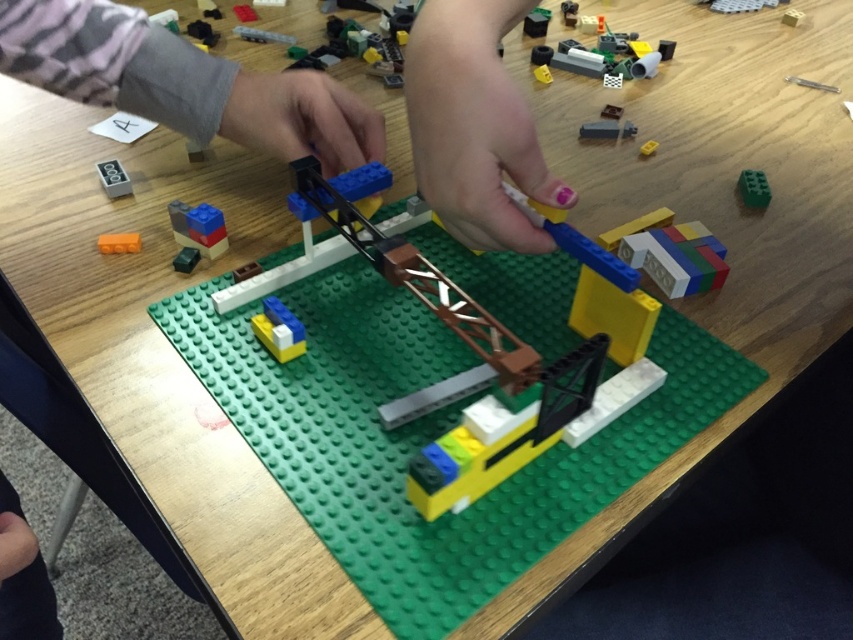
Question: Which point appears closest to the camera in this image?

Choices:
 (A) (793, 24)
 (B) (102, 236)
 (C) (517, 132)

Answer: (C)

Question: Is gray fabric sleeve at upper left to the right of yellow matte brick at center from the viewer's perspective?

Choices:
 (A) no
 (B) yes

Answer: (A)

Question: Which object appears farthest from the camera in this image?

Choices:
 (A) orange matte block at lower left
 (B) yellow matte plastic boat at center

Answer: (B)

Question: Considering the relative positions of matte black sign at upper left and orange matte block at lower left in the image provided, where is matte black sign at upper left located with respect to orange matte block at lower left?

Choices:
 (A) right
 (B) left

Answer: (B)

Question: Does gray fabric sleeve at upper left have a smaller size compared to matte plastic cube at lower left?

Choices:
 (A) no
 (B) yes

Answer: (A)

Question: Which of these objects is positioned closest to the yellow matte brick at center?

Choices:
 (A) matte black rectangular block at upper center
 (B) yellow matte plastic boat at center

Answer: (A)